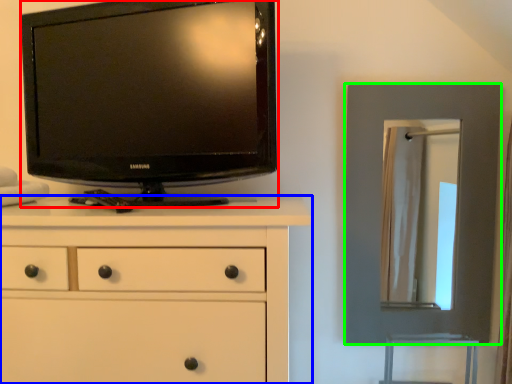
Question: Estimate the real-world distances between objects in this image. Which object is closer to television (highlighted by a red box), chest of drawers (highlighted by a blue box) or picture frame (highlighted by a green box)?

Choices:
 (A) chest of drawers
 (B) picture frame

Answer: (A)